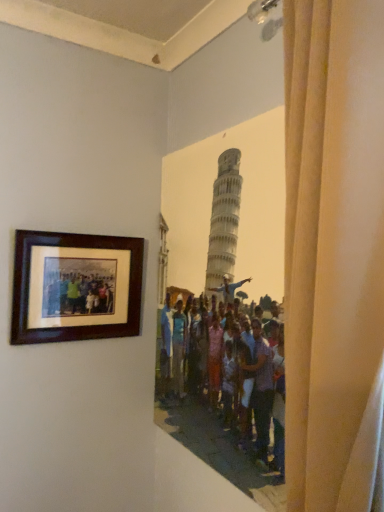
Question: Can you confirm if brown wooden picture frame at upper left is wider than beige fabric curtain at right?

Choices:
 (A) no
 (B) yes

Answer: (A)

Question: Is there a large distance between brown wooden picture frame at upper left and beige fabric curtain at right?

Choices:
 (A) no
 (B) yes

Answer: (A)

Question: Is brown wooden picture frame at upper left further to camera compared to beige fabric curtain at right?

Choices:
 (A) yes
 (B) no

Answer: (A)

Question: Can you confirm if brown wooden picture frame at upper left is thinner than beige fabric curtain at right?

Choices:
 (A) no
 (B) yes

Answer: (B)

Question: Is brown wooden picture frame at upper left shorter than beige fabric curtain at right?

Choices:
 (A) yes
 (B) no

Answer: (A)

Question: Is brown wooden picture frame at upper left taller than beige fabric curtain at right?

Choices:
 (A) no
 (B) yes

Answer: (A)

Question: Does beige fabric curtain at right have a greater width compared to brown wooden picture frame at upper left?

Choices:
 (A) no
 (B) yes

Answer: (B)

Question: Is beige fabric curtain at right not within brown wooden picture frame at upper left?

Choices:
 (A) yes
 (B) no

Answer: (A)

Question: Is beige fabric curtain at right at the left side of brown wooden picture frame at upper left?

Choices:
 (A) yes
 (B) no

Answer: (B)

Question: Can you confirm if beige fabric curtain at right is smaller than brown wooden picture frame at upper left?

Choices:
 (A) yes
 (B) no

Answer: (B)

Question: From the image's perspective, is beige fabric curtain at right beneath brown wooden picture frame at upper left?

Choices:
 (A) yes
 (B) no

Answer: (B)

Question: Is beige fabric curtain at right in front of brown wooden picture frame at upper left?

Choices:
 (A) yes
 (B) no

Answer: (A)

Question: In the image, is brown wooden picture frame at upper left on the left side or the right side of beige fabric curtain at right?

Choices:
 (A) left
 (B) right

Answer: (A)